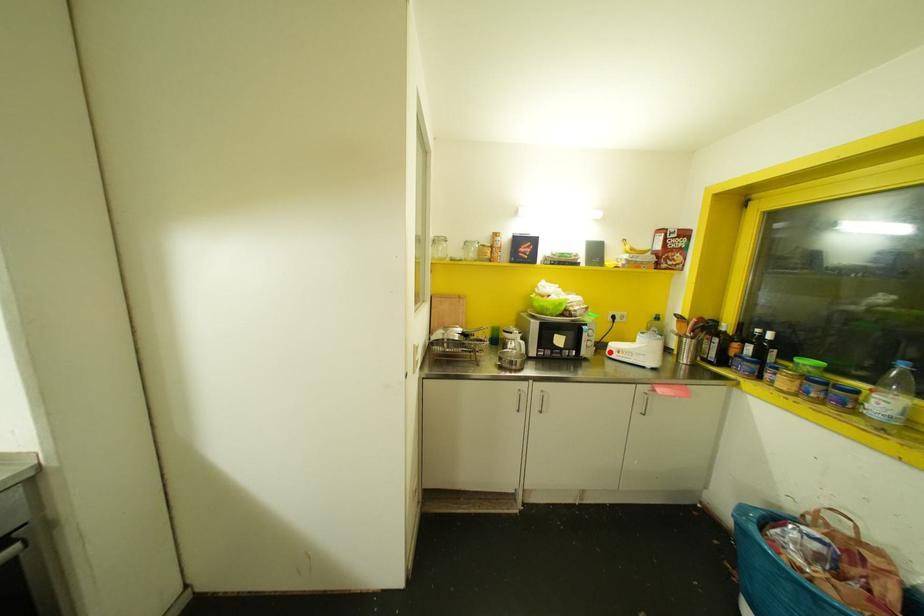
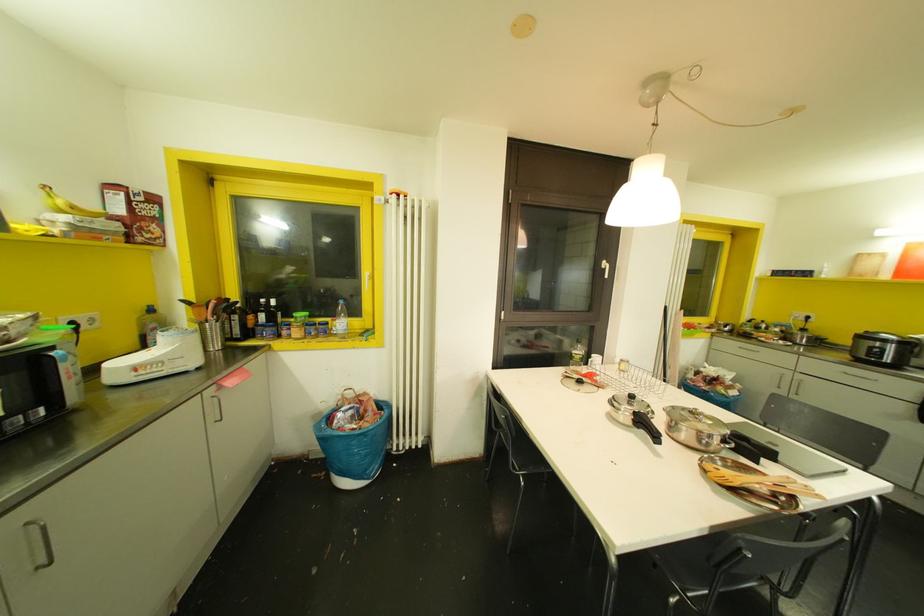
Locate, in the second image, the point that corresponds to the highlighted location in the first image.

(116, 378)